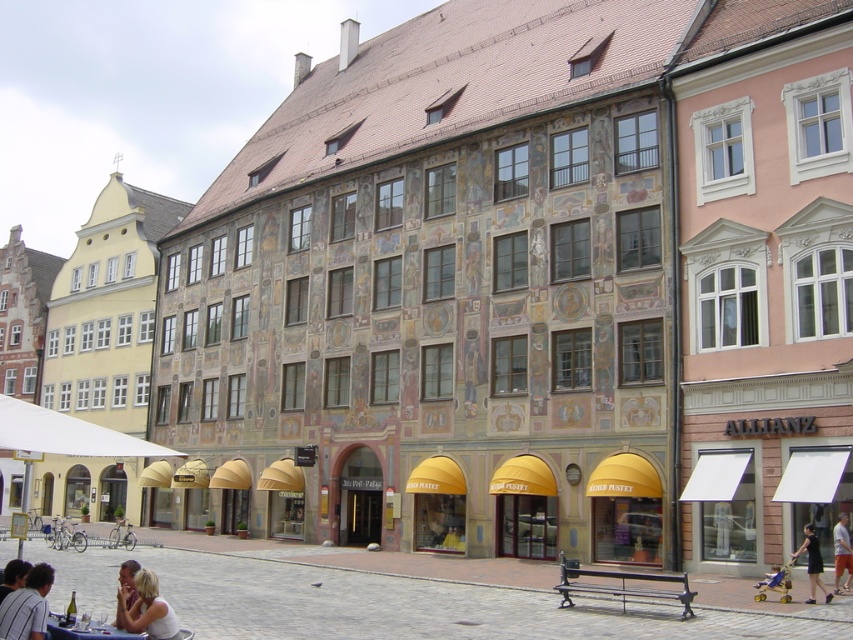
Can you confirm if dark blue shirt at lower left is smaller than black cotton shirt at lower right?

No.

Which is more to the right, dark blue shirt at lower left or black cotton shirt at lower right?

black cotton shirt at lower right

Where is `dark blue shirt at lower left`? This screenshot has width=853, height=640. dark blue shirt at lower left is located at coordinates (27, 605).

Is point (94, 634) farther from viewer compared to point (128, 586)?

No, (94, 634) is closer to viewer.

Does wooden table at lower left appear on the left side of smooth skin face at lower left?

No, wooden table at lower left is not to the left of smooth skin face at lower left.

You are a GUI agent. You are given a task and a screenshot of the screen. Output one action in this format:
    pyautogui.click(x=<x>, y=<y>)
    Task: Click on the wooden table at lower left
    This screenshot has height=640, width=853.
    Given the screenshot: What is the action you would take?
    pyautogui.click(x=85, y=628)

Does dark blue shirt at lower left appear on the left side of light beige fabric dress at lower left?

Indeed, dark blue shirt at lower left is positioned on the left side of light beige fabric dress at lower left.

What do you see at coordinates (27, 605) in the screenshot? This screenshot has height=640, width=853. I see `dark blue shirt at lower left` at bounding box center [27, 605].

The width and height of the screenshot is (853, 640). I want to click on dark blue shirt at lower left, so click(27, 605).